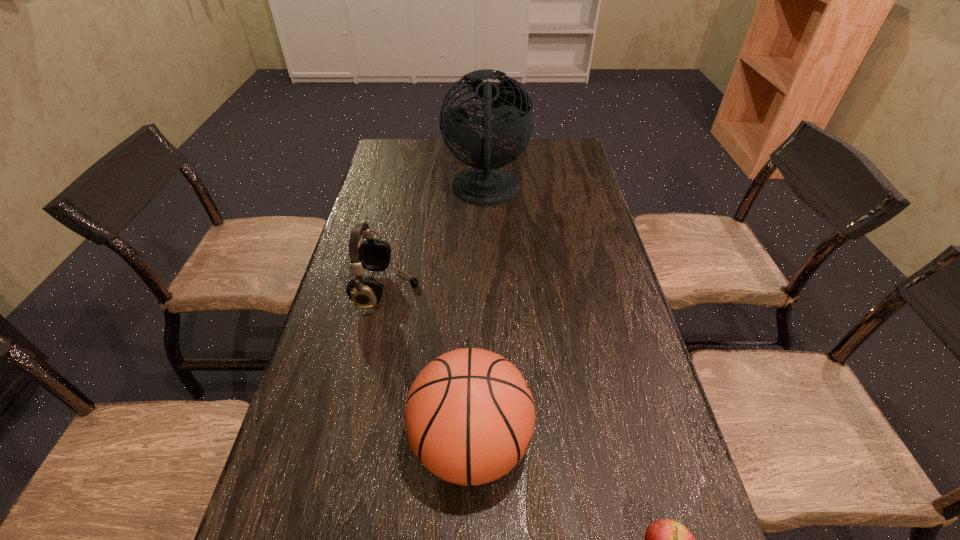
Locate an element on the screen. object that is at the far edge is located at coordinates (486, 183).

Locate an element on the screen. object present at the left edge is located at coordinates (373, 255).

In the image, there is a desktop. Identify the location of vacant space at the far edge. This screenshot has width=960, height=540. (534, 158).

Where is `vacant area at the left edge of the desktop`? vacant area at the left edge of the desktop is located at coordinates (389, 201).

This screenshot has width=960, height=540. In the image, there is a desktop. In order to click on vacant region at the right edge in this screenshot , I will do `click(655, 428)`.

Locate an element on the screen. free point at the far left corner is located at coordinates (392, 151).

You are a GUI agent. You are given a task and a screenshot of the screen. Output one action in this format:
    pyautogui.click(x=<x>, y=<y>)
    Task: Click on the free space between the third nearest object and the farthest object
    The height and width of the screenshot is (540, 960).
    Given the screenshot: What is the action you would take?
    pyautogui.click(x=437, y=241)

Image resolution: width=960 pixels, height=540 pixels. I want to click on free spot between the basketball and the globe, so click(x=478, y=318).

I want to click on vacant area between the second nearest object and the tallest object, so click(x=478, y=318).

You are a GUI agent. You are given a task and a screenshot of the screen. Output one action in this format:
    pyautogui.click(x=<x>, y=<y>)
    Task: Click on the object that can be found as the second closest to the basketball
    This screenshot has width=960, height=540.
    Given the screenshot: What is the action you would take?
    pyautogui.click(x=373, y=255)